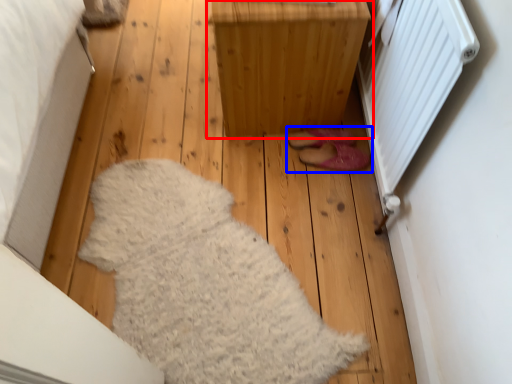
Question: Which object is closer to the camera taking this photo, furniture (highlighted by a red box) or footwear (highlighted by a blue box)?

Choices:
 (A) furniture
 (B) footwear

Answer: (A)